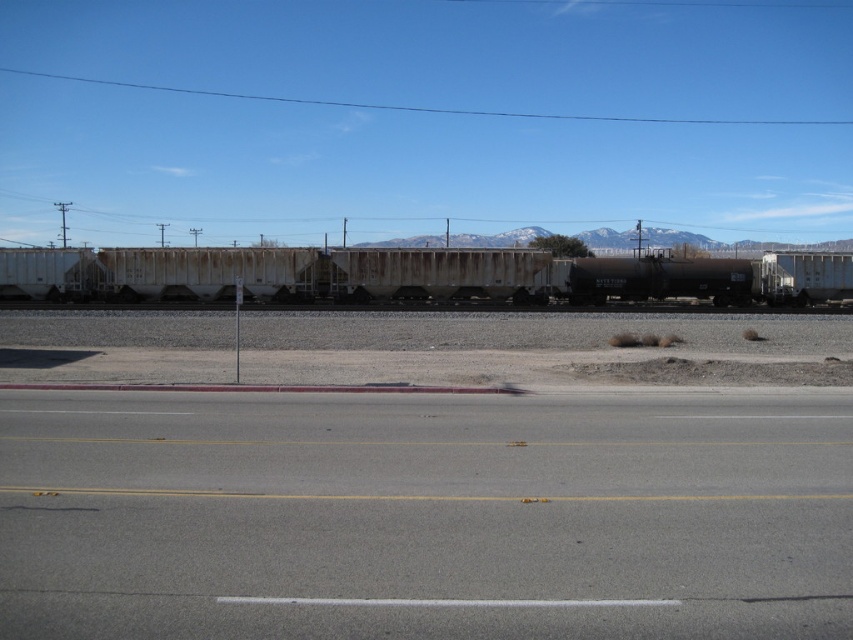
You are standing at the red curb on the road and want to reach both point (680, 500) and point (36, 275). Which point will you reach first if you start walking towards them?

You will reach point (680, 500) first because it is closer to you than point (36, 275).

You are a delivery driver who needs to cross the gray asphalt highway at center to reach the rusty metal train car at center. Is the highway above or below the train car?

The gray asphalt highway at center is located below the rusty metal train car at center, so the highway is below the train car.

You are standing at the edge of the scene and want to cross the gray asphalt highway at center safely. Considering the distance between you and the highway is 4.92 meters, can you safely cross it without any obstacles?

The gray asphalt highway at center is 4.92 meters away from you, so yes, you can safely cross it as the distance is manageable and there are no mentioned obstacles in the scene description.